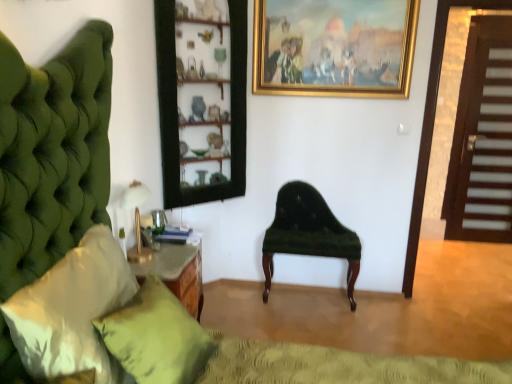
Locate an element on the screen. Image resolution: width=512 pixels, height=384 pixels. free spot to the right of velvet green bench at center is located at coordinates 384,316.